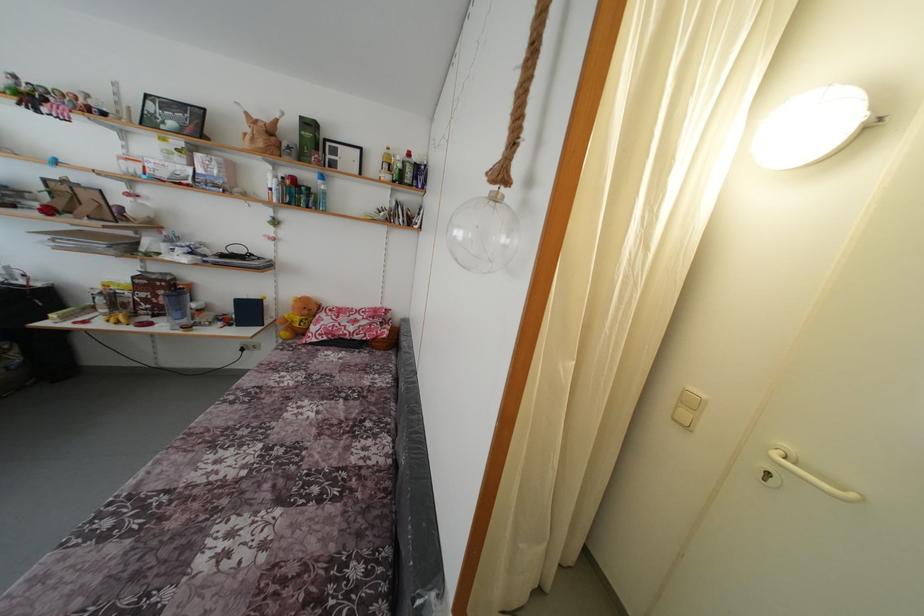
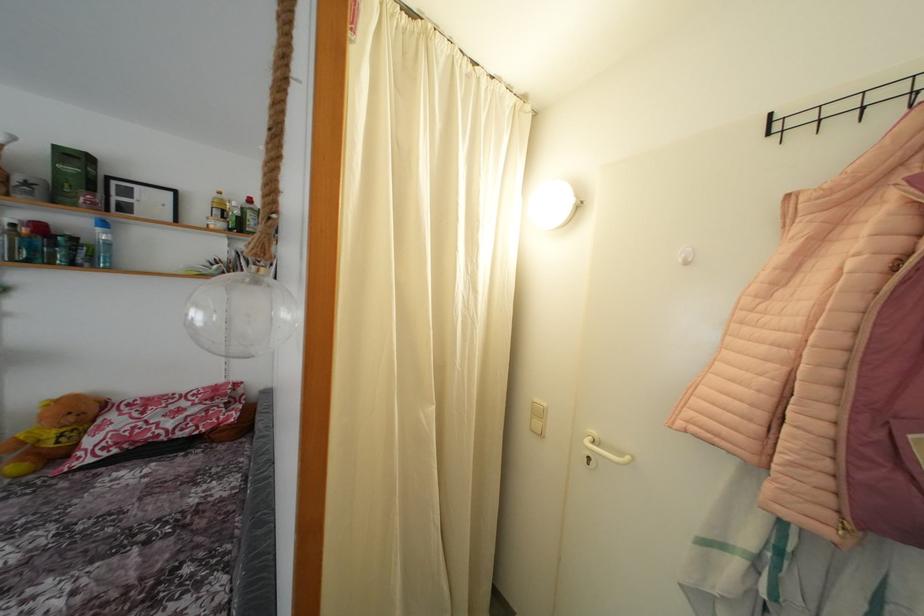
In the second image, find the point that corresponds to the point at 426,233 in the first image.

(281, 286)